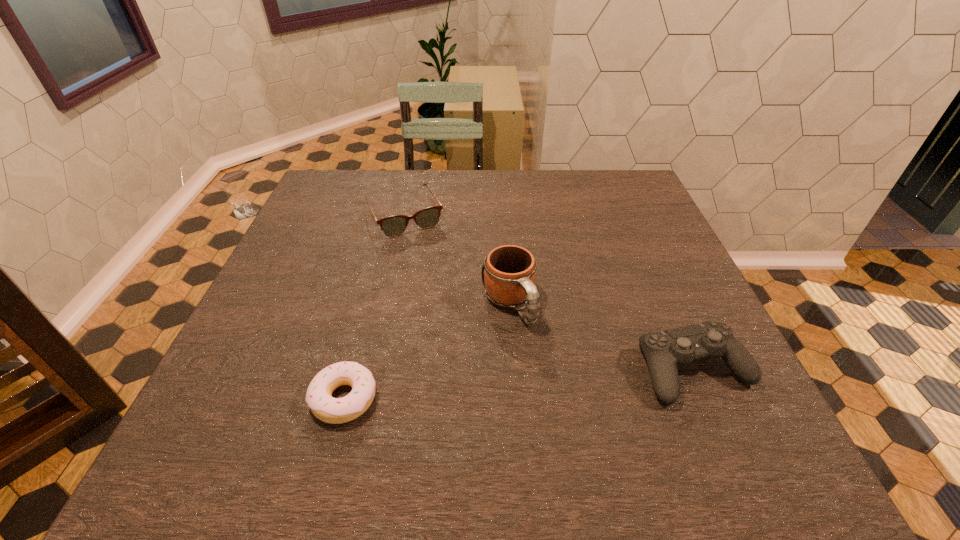
Identify the location of vacant space at the near edge of the desktop. The height and width of the screenshot is (540, 960). (392, 405).

You are a GUI agent. You are given a task and a screenshot of the screen. Output one action in this format:
    pyautogui.click(x=<x>, y=<y>)
    Task: Click on the vacant area at the left edge
    This screenshot has width=960, height=540.
    Given the screenshot: What is the action you would take?
    pyautogui.click(x=293, y=262)

Where is `vacant space at the right edge`? The height and width of the screenshot is (540, 960). vacant space at the right edge is located at coordinates (643, 243).

Where is `free space at the far left corner of the desktop`? The width and height of the screenshot is (960, 540). free space at the far left corner of the desktop is located at coordinates [x=369, y=171].

The height and width of the screenshot is (540, 960). I want to click on free region at the near left corner, so click(233, 403).

This screenshot has width=960, height=540. Find the location of `free space between the doughnut and the rightmost object`. free space between the doughnut and the rightmost object is located at coordinates (519, 384).

Locate an element on the screen. empty space between the mug and the third tallest object is located at coordinates (457, 260).

Where is `free space between the spectacles and the third shortest object`? free space between the spectacles and the third shortest object is located at coordinates (550, 293).

The image size is (960, 540). I want to click on vacant space in between the third object from left to right and the third tallest object, so click(x=457, y=260).

Locate an element on the screen. The image size is (960, 540). vacant area that lies between the spectacles and the mug is located at coordinates (457, 260).